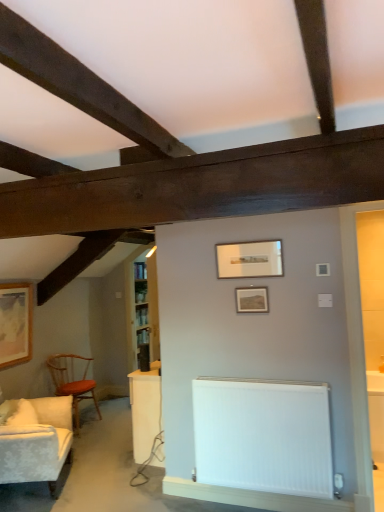
Measure the distance between white textured fabric couch at left and camera.

The depth of white textured fabric couch at left is 2.97 meters.

At what (x,y) coordinates should I click in order to perform the action: click on white glossy table at lower right. Please return your answer as a coordinate pair (x, y). This screenshot has height=512, width=384. Looking at the image, I should click on (376, 413).

Image resolution: width=384 pixels, height=512 pixels. Find the location of `matte wooden picture frame at center, which ranks as the 3th picture frame in left-to-right order`. matte wooden picture frame at center, which ranks as the 3th picture frame in left-to-right order is located at coordinates (252, 300).

The image size is (384, 512). In order to click on white textured fabric couch at left in this screenshot , I will do `click(38, 444)`.

From the picture: Considering the relative sizes of matte silver picture frame at center, arranged as the 2th picture frame when viewed from the left, and white glossy table at lower right in the image provided, is matte silver picture frame at center, arranged as the 2th picture frame when viewed from the left, smaller than white glossy table at lower right?

Yes, matte silver picture frame at center, arranged as the 2th picture frame when viewed from the left, is smaller than white glossy table at lower right.

From a real-world perspective, is matte silver picture frame at center, the third picture frame positioned from the back, located higher than white glossy table at lower right?

Yes, from a real-world perspective, matte silver picture frame at center, the third picture frame positioned from the back, is above white glossy table at lower right.

Considering the sizes of objects matte silver picture frame at center, which is the 2th picture frame from right to left, and white glossy table at lower right in the image provided, who is thinner, matte silver picture frame at center, which is the 2th picture frame from right to left, or white glossy table at lower right?

matte silver picture frame at center, which is the 2th picture frame from right to left.

Is wooden framed picture at left, positioned as the third picture frame in top-to-bottom order, looking in the opposite direction of wooden polished chair at left?

No.

At what (x,y) coordinates should I click in order to perform the action: click on the 1st picture frame in front of the wooden polished chair at left, counting from the anchor's position. Please return your answer as a coordinate pair (x, y). Looking at the image, I should click on (15, 323).

Is wooden framed picture at left, which is the 3th picture frame in front-to-back order, not close to wooden polished chair at left?

No.

Based on the photo, does wooden framed picture at left, marked as the 1th picture frame in a back-to-front arrangement, have a larger size compared to wooden polished chair at left?

No.

From a real-world perspective, which is physically above, matte wooden picture frame at center, positioned as the 2th picture frame in back-to-front order, or matte silver picture frame at center, arranged as the 2th picture frame when viewed from the left?

From a 3D spatial view, matte silver picture frame at center, arranged as the 2th picture frame when viewed from the left, is above.

Are matte wooden picture frame at center, which ranks as the 3th picture frame in left-to-right order, and matte silver picture frame at center, the 3th picture frame ordered from the bottom, beside each other?

No, matte wooden picture frame at center, which ranks as the 3th picture frame in left-to-right order, is not with matte silver picture frame at center, the 3th picture frame ordered from the bottom.

Which is more to the left, matte wooden picture frame at center, which is the second picture frame in front-to-back order, or matte silver picture frame at center, the 1th picture frame from the top?

From the viewer's perspective, matte silver picture frame at center, the 1th picture frame from the top, appears more on the left side.

There is a white smooth radiator at lower center. Identify the location of the 3rd picture frame above it (from a real-world perspective). Image resolution: width=384 pixels, height=512 pixels. (249, 259).

From a real-world perspective, which is physically below, white smooth radiator at lower center or matte silver picture frame at center, the 3th picture frame ordered from the bottom?

In real-world perspective, white smooth radiator at lower center is lower.

Considering the positions of objects white smooth radiator at lower center and matte silver picture frame at center, the 1th picture frame from the top, in the image provided, who is behind, white smooth radiator at lower center or matte silver picture frame at center, the 1th picture frame from the top,?

matte silver picture frame at center, the 1th picture frame from the top, is further away from the camera.

Are white smooth radiator at lower center and matte silver picture frame at center, the 1th picture frame from the top, located far from each other?

Absolutely, white smooth radiator at lower center is distant from matte silver picture frame at center, the 1th picture frame from the top.

Which object is further away from the camera, white textured fabric couch at left or matte silver picture frame at center, which is the 2th picture frame from right to left?

Positioned behind is white textured fabric couch at left.

Find the location of a particular element. studio couch below the matte silver picture frame at center, the 3th picture frame ordered from the bottom (from the image's perspective) is located at coordinates (38, 444).

How different are the orientations of white textured fabric couch at left and matte silver picture frame at center, the 1th picture frame from the top, in degrees?

The angular difference between white textured fabric couch at left and matte silver picture frame at center, the 1th picture frame from the top, is 116 degrees.

Is white textured fabric couch at left completely or partially outside of matte silver picture frame at center, the 3th picture frame ordered from the bottom?

Yes, white textured fabric couch at left is not within matte silver picture frame at center, the 3th picture frame ordered from the bottom.

Can you confirm if white glossy table at lower right is taller than wooden polished chair at left?

In fact, white glossy table at lower right may be shorter than wooden polished chair at left.

Is white glossy table at lower right directly adjacent to wooden polished chair at left?

white glossy table at lower right is not next to wooden polished chair at left, and they're not touching.

Considering the sizes of objects white glossy table at lower right and wooden polished chair at left in the image provided, who is smaller, white glossy table at lower right or wooden polished chair at left?

With smaller size is white glossy table at lower right.

Which is correct: matte wooden picture frame at center, positioned as the 2th picture frame in back-to-front order, is inside wooden framed picture at left, which is the 3th picture frame in front-to-back order, or outside of it?

The correct answer is: outside.

Which is behind, point (248, 287) or point (4, 341)?

The point (4, 341) is more distant.

Is matte wooden picture frame at center, positioned as the second picture frame in top-to-bottom order, oriented away from wooden framed picture at left, which is counted as the 1th picture frame, starting from the bottom?

matte wooden picture frame at center, positioned as the second picture frame in top-to-bottom order, does not have its back to wooden framed picture at left, which is counted as the 1th picture frame, starting from the bottom.

You are a GUI agent. You are given a task and a screenshot of the screen. Output one action in this format:
    pyautogui.click(x=<x>, y=<y>)
    Task: Click on the table below the matte silver picture frame at center, the 3th picture frame ordered from the bottom (from the image's perspective)
    Image resolution: width=384 pixels, height=512 pixels.
    Given the screenshot: What is the action you would take?
    pyautogui.click(x=376, y=413)

There is a wooden polished chair at left. At what (x,y) coordinates should I click in order to perform the action: click on the 1st picture frame above it (from a real-world perspective). Please return your answer as a coordinate pair (x, y). The width and height of the screenshot is (384, 512). Looking at the image, I should click on (15, 323).

Looking at the image, which one is located further to matte silver picture frame at center, which is the 2th picture frame from right to left, wooden framed picture at left, the 3th picture frame from the right, or white smooth radiator at lower center?

wooden framed picture at left, the 3th picture frame from the right.

Estimate the real-world distances between objects in this image. Which object is closer to matte wooden picture frame at center, positioned as the second picture frame in top-to-bottom order, white glossy table at lower right or matte silver picture frame at center, the 3th picture frame ordered from the bottom?

matte silver picture frame at center, the 3th picture frame ordered from the bottom, is closer to matte wooden picture frame at center, positioned as the second picture frame in top-to-bottom order.

Considering their positions, is matte silver picture frame at center, which is the 1th picture frame from front to back, positioned further to wooden polished chair at left than matte wooden picture frame at center, positioned as the 2th picture frame in back-to-front order?

Based on the image, matte silver picture frame at center, which is the 1th picture frame from front to back, appears to be further to wooden polished chair at left.

Based on their spatial positions, is wooden polished chair at left or white textured fabric couch at left closer to white glossy table at lower right?

white textured fabric couch at left.

Which object lies nearer to the anchor point matte wooden picture frame at center, which is the second picture frame in front-to-back order, wooden polished chair at left or matte silver picture frame at center, which is the 2th picture frame from right to left?

matte silver picture frame at center, which is the 2th picture frame from right to left, lies closer to matte wooden picture frame at center, which is the second picture frame in front-to-back order, than the other object.

Consider the image. When comparing their distances from wooden polished chair at left, does white textured fabric couch at left or matte silver picture frame at center, the 1th picture frame from the top, seem further?

Among the two, matte silver picture frame at center, the 1th picture frame from the top, is located further to wooden polished chair at left.

Looking at the image, which one is located closer to wooden framed picture at left, the 3th picture frame from the right, wooden polished chair at left or white glossy table at lower right?

Based on the image, wooden polished chair at left appears to be nearer to wooden framed picture at left, the 3th picture frame from the right.

From the image, which object appears to be farther from wooden framed picture at left, positioned as the third picture frame in top-to-bottom order, white smooth radiator at lower center or white glossy table at lower right?

white glossy table at lower right.

Identify the location of chair between wooden framed picture at left, marked as the 1th picture frame in a back-to-front arrangement, and matte wooden picture frame at center, arranged as the 2th picture frame when ordered from the bottom. (72, 381).

You are a GUI agent. You are given a task and a screenshot of the screen. Output one action in this format:
    pyautogui.click(x=<x>, y=<y>)
    Task: Click on the chair situated between white textured fabric couch at left and white smooth radiator at lower center from left to right
    
    Given the screenshot: What is the action you would take?
    pyautogui.click(x=72, y=381)

Where is `chair situated between white textured fabric couch at left and white glossy table at lower right from left to right`? This screenshot has width=384, height=512. chair situated between white textured fabric couch at left and white glossy table at lower right from left to right is located at coordinates (72, 381).

Image resolution: width=384 pixels, height=512 pixels. Find the location of `studio couch between wooden framed picture at left, positioned as the third picture frame in top-to-bottom order, and matte silver picture frame at center, the 1th picture frame from the top, from left to right`. studio couch between wooden framed picture at left, positioned as the third picture frame in top-to-bottom order, and matte silver picture frame at center, the 1th picture frame from the top, from left to right is located at coordinates (38, 444).